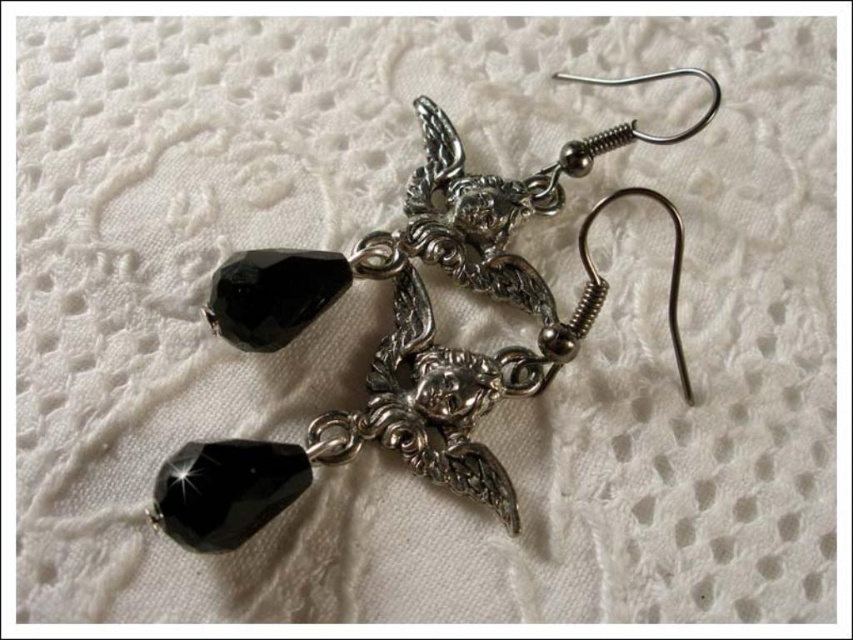
Question: Which object appears farthest from the camera in this image?

Choices:
 (A) silver metallic hook at center
 (B) black faceted glass bead at lower left

Answer: (A)

Question: Does silver metallic hook at center appear on the right side of black faceted glass bead at lower left?

Choices:
 (A) no
 (B) yes

Answer: (B)

Question: Which of the following is the farthest from the observer?

Choices:
 (A) (212, 467)
 (B) (498, 365)

Answer: (B)

Question: Can you confirm if silver metallic hook at center is thinner than black faceted glass bead at lower left?

Choices:
 (A) yes
 (B) no

Answer: (B)

Question: Is silver metallic hook at center above black faceted glass bead at lower left?

Choices:
 (A) no
 (B) yes

Answer: (B)